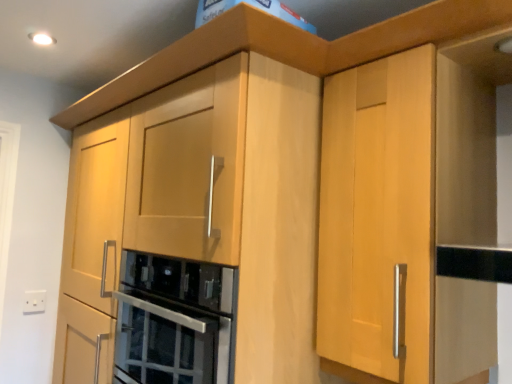
Question: Is white plastic electric outlet at lower left positioned behind stainless steel oven at center?

Choices:
 (A) no
 (B) yes

Answer: (B)

Question: Can you confirm if white plastic electric outlet at lower left is taller than stainless steel oven at center?

Choices:
 (A) no
 (B) yes

Answer: (A)

Question: From the image's perspective, is white plastic electric outlet at lower left located beneath stainless steel oven at center?

Choices:
 (A) no
 (B) yes

Answer: (B)

Question: Is white plastic electric outlet at lower left not near stainless steel oven at center?

Choices:
 (A) no
 (B) yes

Answer: (A)

Question: Is white plastic electric outlet at lower left at the left side of stainless steel oven at center?

Choices:
 (A) yes
 (B) no

Answer: (A)

Question: Is white plastic electric outlet at lower left facing away from stainless steel oven at center?

Choices:
 (A) no
 (B) yes

Answer: (A)

Question: Does stainless steel oven at center have a smaller size compared to white plastic electric outlet at lower left?

Choices:
 (A) yes
 (B) no

Answer: (B)

Question: Considering the relative sizes of stainless steel oven at center and white plastic electric outlet at lower left in the image provided, is stainless steel oven at center taller than white plastic electric outlet at lower left?

Choices:
 (A) no
 (B) yes

Answer: (B)

Question: Is stainless steel oven at center not inside white plastic electric outlet at lower left?

Choices:
 (A) yes
 (B) no

Answer: (A)

Question: Is stainless steel oven at center behind white plastic electric outlet at lower left?

Choices:
 (A) no
 (B) yes

Answer: (A)

Question: From the image's perspective, would you say stainless steel oven at center is positioned over white plastic electric outlet at lower left?

Choices:
 (A) no
 (B) yes

Answer: (B)

Question: Is stainless steel oven at center not close to white plastic electric outlet at lower left?

Choices:
 (A) yes
 (B) no

Answer: (B)

Question: From a real-world perspective, relative to stainless steel oven at center, is white plastic electric outlet at lower left vertically above or below?

Choices:
 (A) below
 (B) above

Answer: (A)